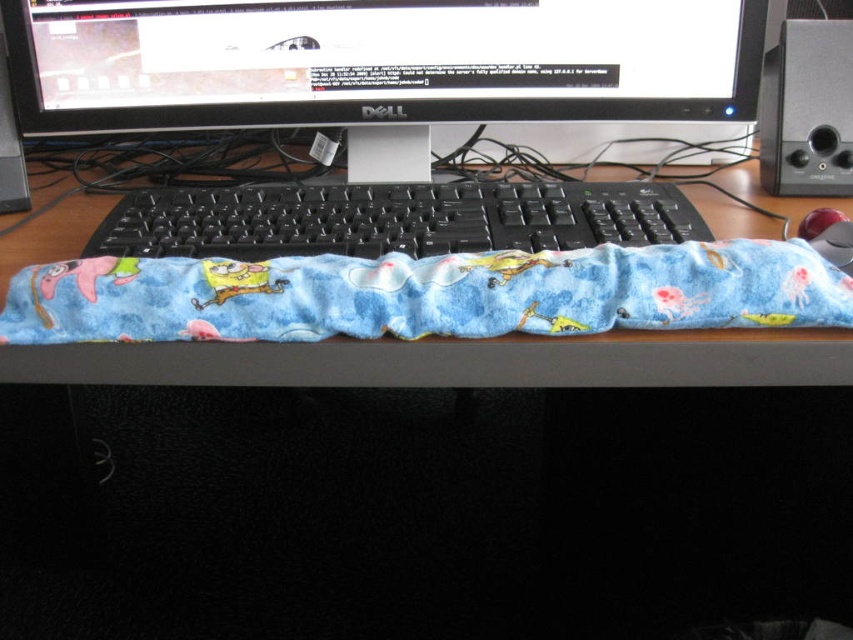
You are setting up your home office and want to place both the blue fleece keyboard cover at center and the black plastic keyboard at center on your desk. Given their sizes, which one should you place first to ensure they fit properly?

The blue fleece keyboard cover at center has a larger size compared to the black plastic keyboard at center. Therefore, you should place the blue fleece keyboard cover at center first to accommodate its larger size before positioning the black plastic keyboard at center.

You are a photographer trying to capture a closeup of the SpongeBob SquarePants wrist rest. The camera is positioned at a certain distance. Can you determine if the point at coordinates point (303, 124) is within the camera frame?

The point (303, 124) is 81.89 centimeters from the camera. If the camera frame can capture objects within that distance, then yes, but the exact visibility depends on the camera lens and zoom settings.

You are setting up your home office and want to ensure that your new Dell computer monitor has enough space for both the blue fleece keyboard cover at center and the blue fleece blanket at center. Based on the image provided, which item is closer to the monitor?

The blue fleece keyboard cover at center is closer to the monitor because the blue fleece blanket at center is positioned behind it.